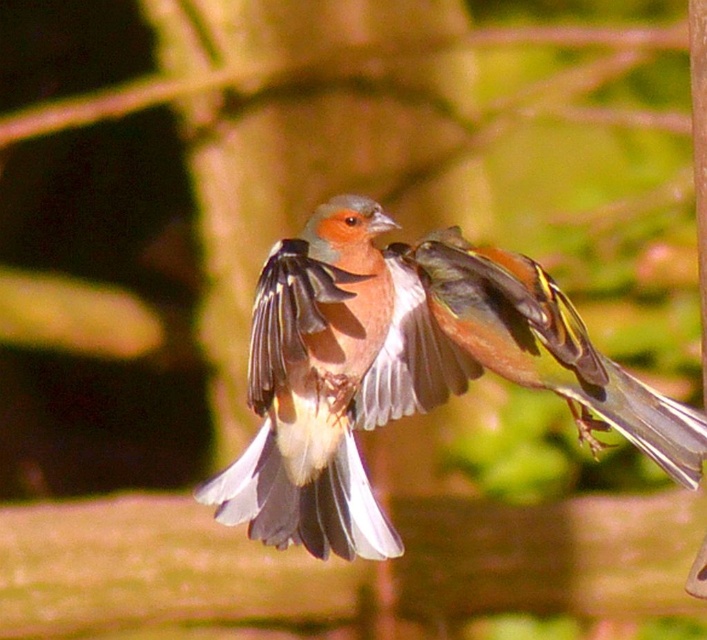
Does shiny brown bird at center have a greater height compared to matte brown bird at center?

Yes.

From the picture: Is shiny brown bird at center positioned behind matte brown bird at center?

Yes.

The height and width of the screenshot is (640, 707). Describe the element at coordinates (332, 384) in the screenshot. I see `shiny brown bird at center` at that location.

What are the coordinates of `shiny brown bird at center` in the screenshot? It's located at (332, 384).